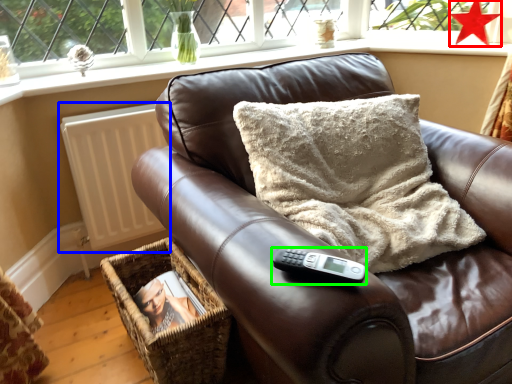
Question: Considering the real-world distances, which object is farthest from star (highlighted by a red box)? radiator (highlighted by a blue box) or remote (highlighted by a green box)?

Choices:
 (A) radiator
 (B) remote

Answer: (B)